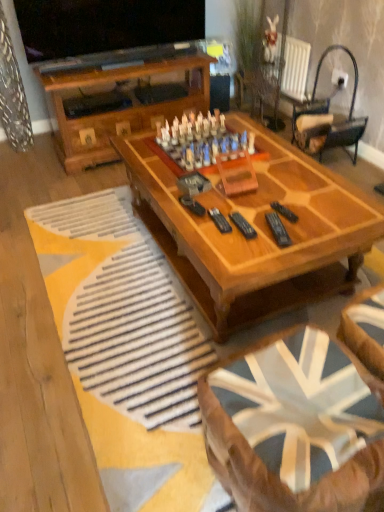
I want to click on free space in front of black plastic remote at center, which appears as the third remote when viewed from the right, so click(248, 251).